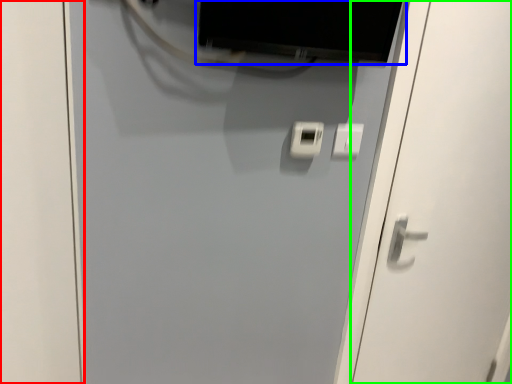
Question: Based on their relative distances, which object is farther from door (highlighted by a red box)? Choose from computer monitor (highlighted by a blue box) and door (highlighted by a green box).

Choices:
 (A) computer monitor
 (B) door

Answer: (B)